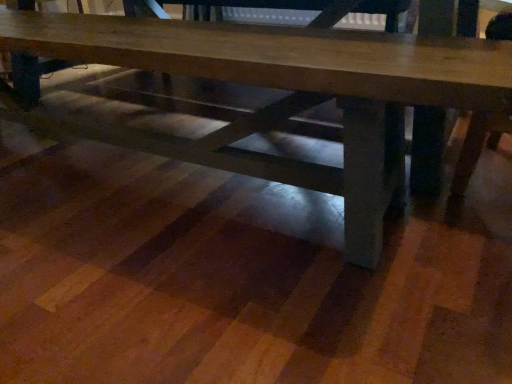
Describe the element at coordinates (294, 79) in the screenshot. I see `natural wood table at center` at that location.

Locate an element on the screen. This screenshot has width=512, height=384. natural wood table at center is located at coordinates (294, 79).

What are the coordinates of `natural wood table at center` in the screenshot? It's located at (294, 79).